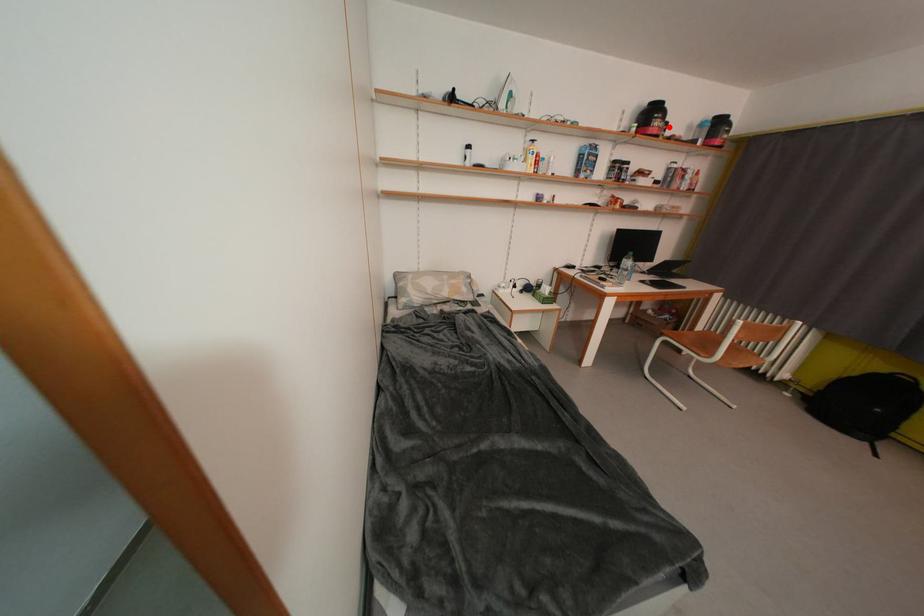
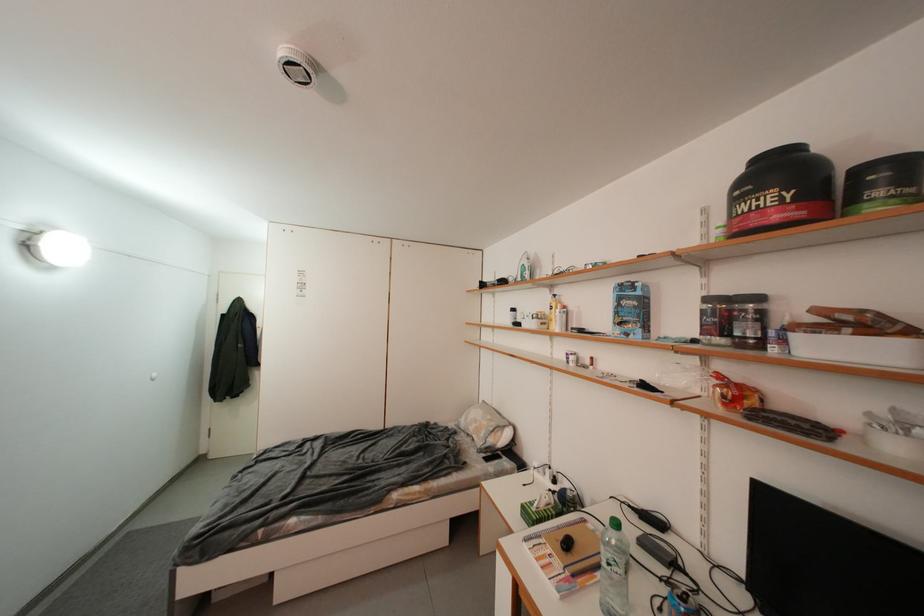
The point at the highlighted location is marked in the first image. Where is the corresponding point in the second image?

(776, 201)